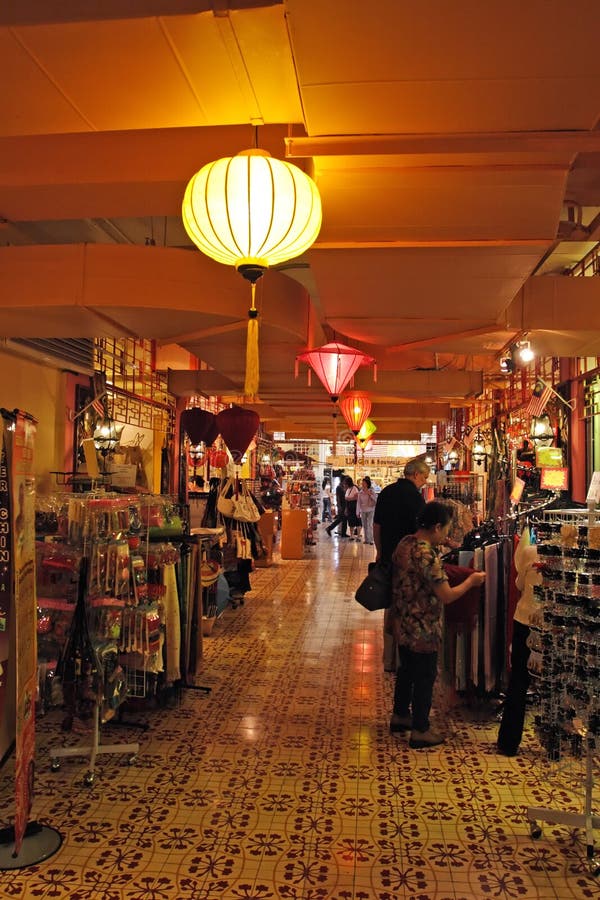
This screenshot has width=600, height=900. Identify the location of wood cashier desk. (293, 528).